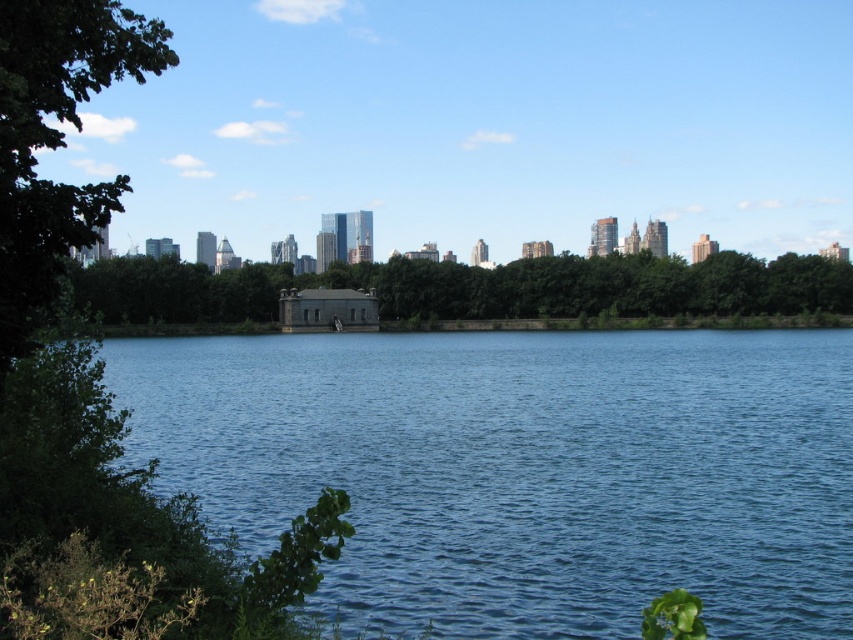
Question: Can you confirm if blue water at center is positioned to the right of green leafy trees at center?

Choices:
 (A) no
 (B) yes

Answer: (A)

Question: Which point is closer to the camera?

Choices:
 (A) (213, 385)
 (B) (3, 259)

Answer: (B)

Question: Can you confirm if blue water at center is positioned below green leafy trees at center?

Choices:
 (A) no
 (B) yes

Answer: (B)

Question: Is blue water at center to the right of green leafy trees at center from the viewer's perspective?

Choices:
 (A) no
 (B) yes

Answer: (A)

Question: Among these objects, which one is nearest to the camera?

Choices:
 (A) blue water at center
 (B) green leafy tree at left

Answer: (A)

Question: Among these points, which one is farthest from the camera?

Choices:
 (A) (479, 628)
 (B) (74, 193)
 (C) (418, 291)

Answer: (C)